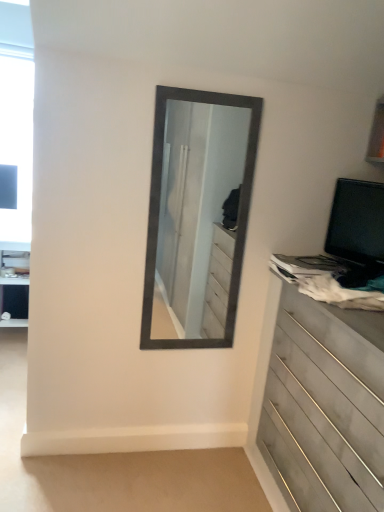
Question: Is black glossy computer monitor at right further to the viewer compared to wooden chest of drawers at right?

Choices:
 (A) no
 (B) yes

Answer: (B)

Question: Could you tell me if black glossy computer monitor at right is turned towards wooden chest of drawers at right?

Choices:
 (A) yes
 (B) no

Answer: (B)

Question: Is black glossy computer monitor at right positioned with its back to wooden chest of drawers at right?

Choices:
 (A) no
 (B) yes

Answer: (A)

Question: Are black glossy computer monitor at right and wooden chest of drawers at right located far from each other?

Choices:
 (A) no
 (B) yes

Answer: (A)

Question: Is black glossy computer monitor at right with wooden chest of drawers at right?

Choices:
 (A) no
 (B) yes

Answer: (A)

Question: Could wooden chest of drawers at right be considered to be inside black glossy computer monitor at right?

Choices:
 (A) no
 (B) yes

Answer: (A)

Question: Is wooden chest of drawers at right located outside black glossy computer monitor at right?

Choices:
 (A) no
 (B) yes

Answer: (B)

Question: Does wooden chest of drawers at right contain black glossy computer monitor at right?

Choices:
 (A) yes
 (B) no

Answer: (B)

Question: Can you confirm if wooden chest of drawers at right is bigger than black glossy computer monitor at right?

Choices:
 (A) yes
 (B) no

Answer: (A)

Question: Is wooden chest of drawers at right turned away from black glossy computer monitor at right?

Choices:
 (A) yes
 (B) no

Answer: (B)

Question: Is wooden chest of drawers at right positioned before black glossy computer monitor at right?

Choices:
 (A) no
 (B) yes

Answer: (B)

Question: Can you confirm if wooden chest of drawers at right is smaller than black glossy computer monitor at right?

Choices:
 (A) no
 (B) yes

Answer: (A)

Question: Based on their positions, is wooden chest of drawers at right located to the left or right of black glossy computer monitor at right?

Choices:
 (A) left
 (B) right

Answer: (A)